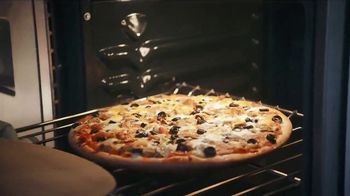
Where is `oven rack pizza is on`? oven rack pizza is on is located at coordinates (63, 119).